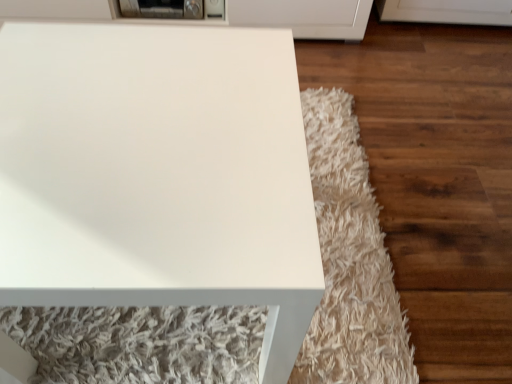
Question: Would you say metallic gray toaster at upper center is inside or outside white glossy table at center?

Choices:
 (A) inside
 (B) outside

Answer: (B)

Question: Considering the positions of point (117, 4) and point (99, 271), is point (117, 4) closer or farther from the camera than point (99, 271)?

Choices:
 (A) closer
 (B) farther

Answer: (B)

Question: From the image's perspective, is metallic gray toaster at upper center located above or below white glossy table at center?

Choices:
 (A) above
 (B) below

Answer: (A)

Question: Looking at their shapes, would you say white glossy table at center is wider or thinner than metallic gray toaster at upper center?

Choices:
 (A) thin
 (B) wide

Answer: (B)

Question: Is white glossy table at center in front of or behind metallic gray toaster at upper center in the image?

Choices:
 (A) behind
 (B) front

Answer: (B)

Question: Is white glossy table at center taller or shorter than metallic gray toaster at upper center?

Choices:
 (A) short
 (B) tall

Answer: (B)

Question: Considering the relative positions of white glossy table at center and metallic gray toaster at upper center in the image provided, is white glossy table at center to the left or to the right of metallic gray toaster at upper center?

Choices:
 (A) left
 (B) right

Answer: (B)